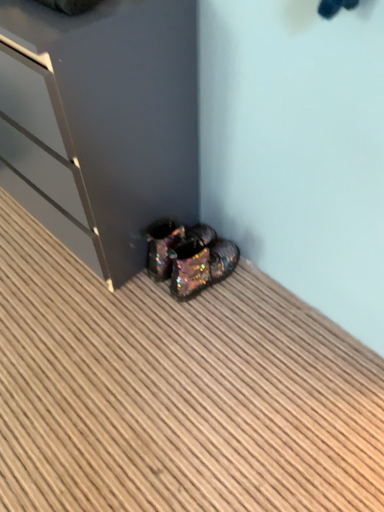
Locate an element on the screen. The height and width of the screenshot is (512, 384). free space to the left of iridescent glittery shoes at lower center is located at coordinates (141, 301).